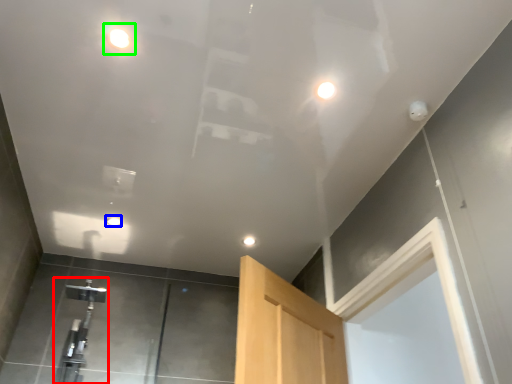
Question: Which is farther away from faucet (highlighted by a red box)? droplight (highlighted by a blue box) or droplight (highlighted by a green box)?

Choices:
 (A) droplight
 (B) droplight

Answer: (B)